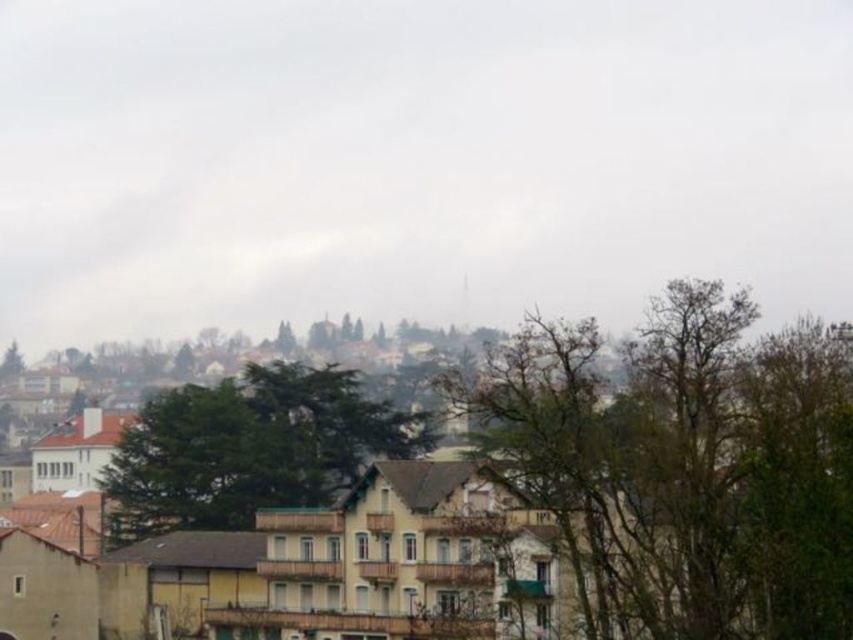
You are a delivery drone with a maximum flight range of 50 meters. You need to deliver a package from your current location to the yellow matte building at center. Can you reach it without recharging?

The yellow matte building at center is 57.16 meters away, which exceeds the drone maximum flight range of 50 meters. The drone cannot reach it without recharging.

You are a delivery drone flying over the hilly urban landscape. You need to deliver a package to the yellow matte building at center. However, there is a brown leafless tree at center in your path. Can you safely fly under the tree to reach the building?

The yellow matte building at center is located below the brown leafless tree at center, so yes, the drone can safely fly under the brown leafless tree at center to reach the yellow matte building at center.

You are standing in the hilly urban landscape and want to take a photo of both the brown leafless tree at center and the green leafy tree at center. Which tree should you focus on first to ensure both are in the frame?

You should focus on the brown leafless tree at center first because it is closer to the viewer than the green leafy tree at center, so adjusting the camera to include both would require ensuring the closer tree is framed before the farther one.